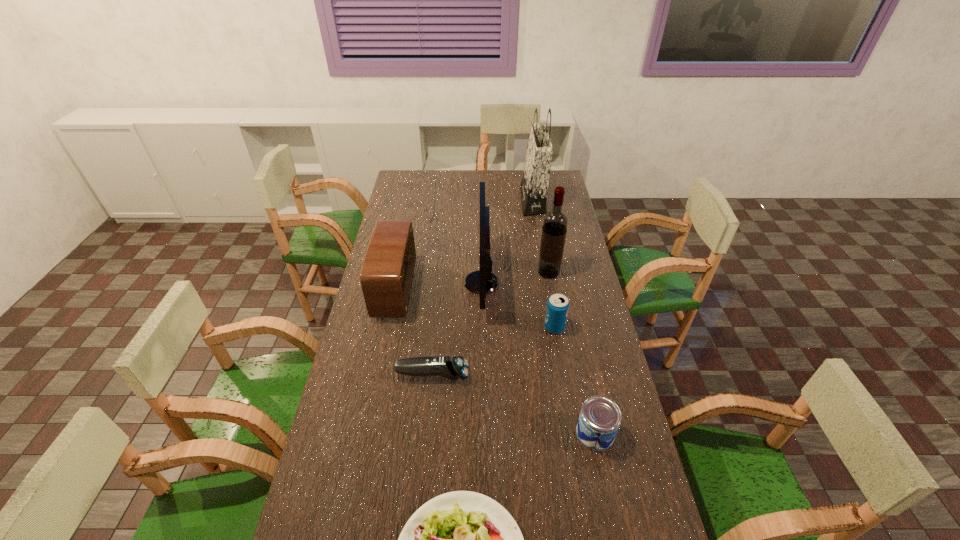
The image size is (960, 540). Identify the location of vacant area located on the front of the farthest object with the design. (474, 200).

Where is `vacant space located 0.370m on the front of the farthest object with the design`? This screenshot has width=960, height=540. vacant space located 0.370m on the front of the farthest object with the design is located at coordinates (445, 200).

Where is `blank space located on the front of the farthest object with the design`? blank space located on the front of the farthest object with the design is located at coordinates (487, 200).

Locate an element on the screen. This screenshot has width=960, height=540. free spot located on the left of the second tallest object is located at coordinates (438, 273).

Image resolution: width=960 pixels, height=540 pixels. I want to click on blank space located on the front-facing side of the computer monitor, so (x=382, y=282).

Identify the location of vacant space located 0.050m on the front-facing side of the computer monitor. This screenshot has width=960, height=540. (451, 282).

Identify the location of free space located 0.320m on the front-facing side of the computer monitor. (382, 282).

The image size is (960, 540). In order to click on vacant space located 0.320m on the front-facing side of the radio receiver in this screenshot , I will do `click(496, 291)`.

Image resolution: width=960 pixels, height=540 pixels. I want to click on free space located 0.270m on the back of the fifth tallest object, so click(545, 270).

You are a GUI agent. You are given a task and a screenshot of the screen. Output one action in this format:
    pyautogui.click(x=<x>, y=<y>)
    Task: Click on the blank space located 0.320m on the front label of the third shortest object
    The image size is (960, 540).
    Given the screenshot: What is the action you would take?
    pyautogui.click(x=464, y=433)